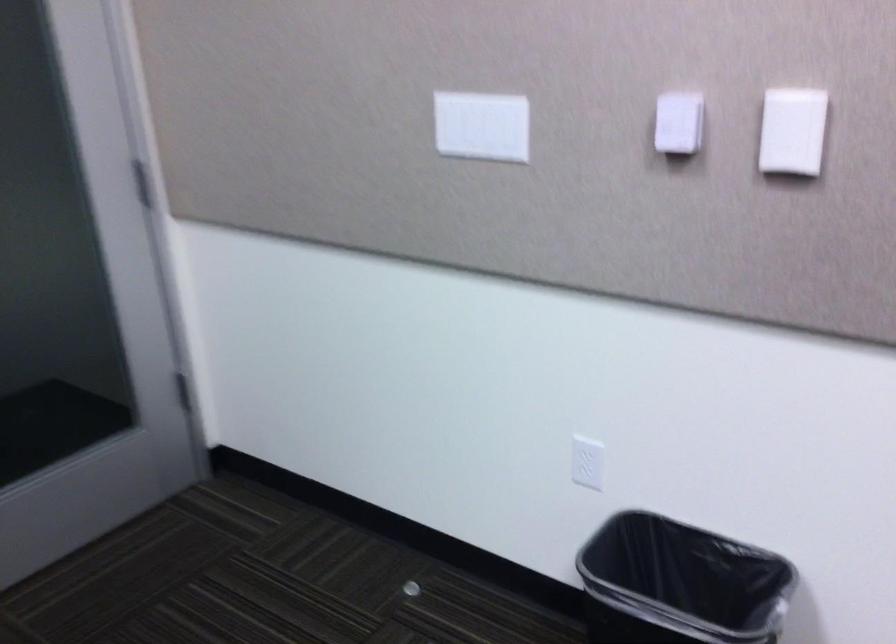
Image resolution: width=896 pixels, height=644 pixels. What are the coordinates of `white light switch` in the screenshot? It's located at (587, 462).